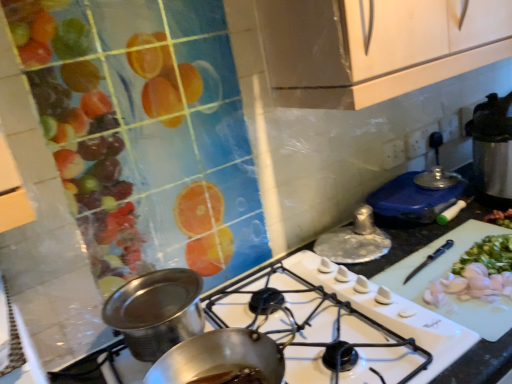
What do you see at coordinates (354, 240) in the screenshot? This screenshot has width=512, height=384. I see `silver metallic lid at center, the 2th kitchen appliance when ordered from right to left` at bounding box center [354, 240].

Identify the location of white glossy gas stove at center. This screenshot has height=384, width=512. (391, 314).

Identify the location of shiny metallic lid at upper right, which appears as the first kitchen appliance when viewed from the top. This screenshot has height=384, width=512. pos(436,169).

The width and height of the screenshot is (512, 384). Describe the element at coordinates (156, 311) in the screenshot. I see `shiny metallic pot at center, arranged as the 3th kitchen appliance when viewed from the right` at that location.

What is the approximate height of white plastic cutting board at center-right?

It is 2.53 inches.

Where is `silver metallic lid at center, which appears as the 2th kitchen appliance when viewed from the left`? The height and width of the screenshot is (384, 512). silver metallic lid at center, which appears as the 2th kitchen appliance when viewed from the left is located at coordinates (354, 240).

Is silver metallic lid at center, the second kitchen appliance when ordered from bottom to top, at the back of white plastic cutting board at center-right?

Absolutely, white plastic cutting board at center-right is directed away from silver metallic lid at center, the second kitchen appliance when ordered from bottom to top.

What are the coordinates of `cutting board located in front of the silver metallic lid at center, which appears as the 2th kitchen appliance when viewed from the left` in the screenshot? It's located at (444, 274).

Is white plastic cutting board at center-right located outside silver metallic lid at center, the second kitchen appliance when ordered from bottom to top?

Indeed, white plastic cutting board at center-right is completely outside silver metallic lid at center, the second kitchen appliance when ordered from bottom to top.

Considering the sizes of objects shiny metallic pot at center, marked as the third kitchen appliance in a top-to-bottom arrangement, and shiny metallic lid at upper right, marked as the 1th kitchen appliance in a right-to-left arrangement, in the image provided, who is taller, shiny metallic pot at center, marked as the third kitchen appliance in a top-to-bottom arrangement, or shiny metallic lid at upper right, marked as the 1th kitchen appliance in a right-to-left arrangement,?

shiny metallic pot at center, marked as the third kitchen appliance in a top-to-bottom arrangement, is taller.

Based on the photo, can you confirm if shiny metallic pot at center, arranged as the 3th kitchen appliance when viewed from the right, is thinner than shiny metallic lid at upper right, arranged as the third kitchen appliance when ordered from the bottom?

No.

Is shiny metallic pot at center, arranged as the 3th kitchen appliance when viewed from the right, looking in the opposite direction of shiny metallic lid at upper right, marked as the first kitchen appliance in a back-to-front arrangement?

No, shiny metallic pot at center, arranged as the 3th kitchen appliance when viewed from the right,'s orientation is not away from shiny metallic lid at upper right, marked as the first kitchen appliance in a back-to-front arrangement.

From a real-world perspective, which kitchen appliance is the 1st one underneath the shiny metallic lid at upper right, which appears as the 3th kitchen appliance when viewed from the left? Please provide its 2D coordinates.

[(156, 311)]

Does white plastic cutting board at center-right have a greater height compared to shiny metallic pot at center, arranged as the 3th kitchen appliance when viewed from the right?

No.

From the image's perspective, between white plastic cutting board at center-right and shiny metallic pot at center, marked as the third kitchen appliance in a top-to-bottom arrangement, which one is located above?

white plastic cutting board at center-right is shown above in the image.

Measure the distance from white plastic cutting board at center-right to shiny metallic pot at center, marked as the first kitchen appliance in a left-to-right arrangement.

The distance of white plastic cutting board at center-right from shiny metallic pot at center, marked as the first kitchen appliance in a left-to-right arrangement, is 52.56 centimeters.

Considering the relative positions of white plastic cutting board at center-right and shiny metallic pot at center, the third kitchen appliance viewed from the back, in the image provided, is white plastic cutting board at center-right in front of shiny metallic pot at center, the third kitchen appliance viewed from the back,?

No, the depth of white plastic cutting board at center-right is greater than that of shiny metallic pot at center, the third kitchen appliance viewed from the back.

Visually, is shiny metallic lid at upper right, the third kitchen appliance viewed from the front, positioned to the left or to the right of white glossy gas stove at center?

shiny metallic lid at upper right, the third kitchen appliance viewed from the front, is to the right of white glossy gas stove at center.

Between shiny metallic lid at upper right, marked as the first kitchen appliance in a back-to-front arrangement, and white glossy gas stove at center, which one has more height?

Standing taller between the two is shiny metallic lid at upper right, marked as the first kitchen appliance in a back-to-front arrangement.

Which of these two, shiny metallic lid at upper right, arranged as the third kitchen appliance when ordered from the bottom, or white glossy gas stove at center, is thinner?

shiny metallic lid at upper right, arranged as the third kitchen appliance when ordered from the bottom.

From a real-world perspective, is white glossy gas stove at center physically below white plastic cutting board at center-right?

No, from a real-world perspective, white glossy gas stove at center is not beneath white plastic cutting board at center-right.

Is there a large distance between white glossy gas stove at center and white plastic cutting board at center-right?

white glossy gas stove at center is actually quite close to white plastic cutting board at center-right.

Which of these two, white glossy gas stove at center or white plastic cutting board at center-right, is thinner?

white plastic cutting board at center-right.

Is silver metallic lid at center, which appears as the 2th kitchen appliance when viewed from the left, smaller than white plastic cutting board at center-right?

Correct, silver metallic lid at center, which appears as the 2th kitchen appliance when viewed from the left, occupies less space than white plastic cutting board at center-right.

From the picture: Is silver metallic lid at center, which appears as the 2th kitchen appliance when viewed from the left, touching white plastic cutting board at center-right?

No.

Is white glossy gas stove at center not close to silver metallic lid at center, the second kitchen appliance when ordered from top to bottom?

Actually, white glossy gas stove at center and silver metallic lid at center, the second kitchen appliance when ordered from top to bottom, are a little close together.

From the image's perspective, is white glossy gas stove at center located above or below silver metallic lid at center, the second kitchen appliance when ordered from bottom to top?

white glossy gas stove at center is situated lower than silver metallic lid at center, the second kitchen appliance when ordered from bottom to top, in the image.

Looking at this image, between white glossy gas stove at center and silver metallic lid at center, the second kitchen appliance when ordered from top to bottom, which one has larger width?

With larger width is white glossy gas stove at center.

Who is taller, white glossy gas stove at center or silver metallic lid at center, which appears as the 2th kitchen appliance when viewed from the left?

Standing taller between the two is silver metallic lid at center, which appears as the 2th kitchen appliance when viewed from the left.

This screenshot has height=384, width=512. Identify the location of the 1st kitchen appliance behind when counting from the white plastic cutting board at center-right. (354, 240).

From the image's perspective, which kitchen appliance is the 2nd one above the shiny metallic pot at center, the third kitchen appliance viewed from the back? Please provide its 2D coordinates.

[(436, 169)]

When comparing their distances from shiny metallic lid at upper right, arranged as the third kitchen appliance when ordered from the bottom, does silver metallic lid at center, the second kitchen appliance when ordered from top to bottom, or white plastic cutting board at center-right seem further?

white plastic cutting board at center-right lies further to shiny metallic lid at upper right, arranged as the third kitchen appliance when ordered from the bottom, than the other object.

Looking at the image, which one is located further to shiny metallic pot at center, arranged as the first kitchen appliance when ordered from the bottom, white glossy gas stove at center or shiny metallic lid at upper right, the third kitchen appliance viewed from the front?

Among the two, shiny metallic lid at upper right, the third kitchen appliance viewed from the front, is located further to shiny metallic pot at center, arranged as the first kitchen appliance when ordered from the bottom.

Looking at the image, which one is located closer to silver metallic lid at center, placed as the second kitchen appliance when sorted from front to back, white glossy gas stove at center or white plastic cutting board at center-right?

The object closer to silver metallic lid at center, placed as the second kitchen appliance when sorted from front to back, is white plastic cutting board at center-right.

Which object lies nearer to the anchor point silver metallic lid at center, the 2th kitchen appliance when ordered from right to left, shiny metallic pot at center, which is the 1th kitchen appliance from front to back, or white plastic cutting board at center-right?

Among the two, white plastic cutting board at center-right is located nearer to silver metallic lid at center, the 2th kitchen appliance when ordered from right to left.

Considering their positions, is silver metallic lid at center, the second kitchen appliance when ordered from top to bottom, positioned closer to white plastic cutting board at center-right than white glossy gas stove at center?

Among the two, white glossy gas stove at center is located nearer to white plastic cutting board at center-right.

Based on the photo, which object lies further to the anchor point shiny metallic pot at center, arranged as the 3th kitchen appliance when viewed from the right, white plastic cutting board at center-right or white glossy gas stove at center?

Based on the image, white plastic cutting board at center-right appears to be further to shiny metallic pot at center, arranged as the 3th kitchen appliance when viewed from the right.

From the picture: When comparing their distances from white glossy gas stove at center, does shiny metallic lid at upper right, arranged as the third kitchen appliance when ordered from the bottom, or shiny metallic pot at center, marked as the third kitchen appliance in a top-to-bottom arrangement, seem further?

The object further to white glossy gas stove at center is shiny metallic lid at upper right, arranged as the third kitchen appliance when ordered from the bottom.

Estimate the real-world distances between objects in this image. Which object is further from shiny metallic pot at center, arranged as the 3th kitchen appliance when viewed from the right, white plastic cutting board at center-right or silver metallic lid at center, placed as the second kitchen appliance when sorted from front to back?

The object further to shiny metallic pot at center, arranged as the 3th kitchen appliance when viewed from the right, is white plastic cutting board at center-right.

Find the location of a particular element. kitchen appliance located between shiny metallic pot at center, which is the 1th kitchen appliance from front to back, and shiny metallic lid at upper right, marked as the 1th kitchen appliance in a right-to-left arrangement, in the left-right direction is located at coordinates (354, 240).

Where is `cutting board situated between shiny metallic pot at center, which is the 1th kitchen appliance from front to back, and shiny metallic lid at upper right, marked as the 1th kitchen appliance in a right-to-left arrangement, from left to right`? The height and width of the screenshot is (384, 512). cutting board situated between shiny metallic pot at center, which is the 1th kitchen appliance from front to back, and shiny metallic lid at upper right, marked as the 1th kitchen appliance in a right-to-left arrangement, from left to right is located at coordinates (444, 274).

What are the coordinates of `gas stove located between shiny metallic pot at center, arranged as the first kitchen appliance when ordered from the bottom, and white plastic cutting board at center-right in the left-right direction` in the screenshot? It's located at (391, 314).

Where is `gas stove situated between shiny metallic pot at center, arranged as the first kitchen appliance when ordered from the bottom, and shiny metallic lid at upper right, which appears as the first kitchen appliance when viewed from the top, from left to right`? gas stove situated between shiny metallic pot at center, arranged as the first kitchen appliance when ordered from the bottom, and shiny metallic lid at upper right, which appears as the first kitchen appliance when viewed from the top, from left to right is located at coordinates (391, 314).